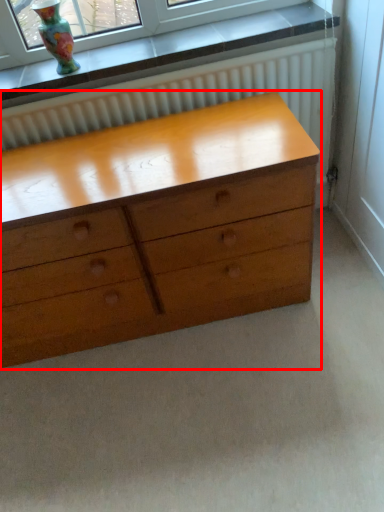
Question: From the image's perspective, what is the correct spatial positioning of chest of drawers (annotated by the red box) in reference to vase?

Choices:
 (A) above
 (B) below

Answer: (B)